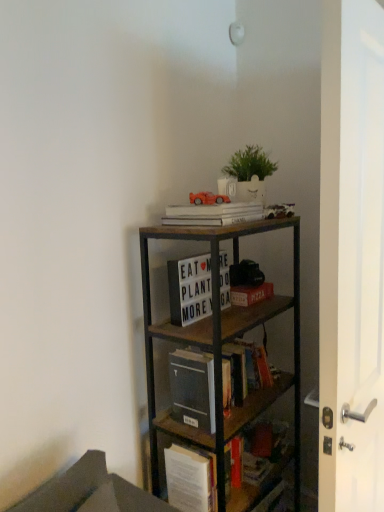
Question: In terms of width, does wooden book at center, placed as the first book when sorted from bottom to top, look wider or thinner when compared to white matte letter board at center, which is counted as the third book, starting from the bottom?

Choices:
 (A) wide
 (B) thin

Answer: (A)

Question: Is point (236, 367) positioned closer to the camera than point (187, 275)?

Choices:
 (A) closer
 (B) farther

Answer: (A)

Question: Estimate the real-world distances between objects in this image. Which object is closer to the white matte planter at upper center?

Choices:
 (A) wooden book at center, which ranks as the 4th book in top-to-bottom order
 (B) white matte book at upper center, which ranks as the first book in top-to-bottom order
 (C) white glossy door at right
 (D) white matte letter board at center, which is counted as the third book, starting from the bottom
 (E) matte cardboard book at center, the third book when ordered from top to bottom

Answer: (B)

Question: Which object is positioned closest to the matte cardboard book at center, which is the 2th book from bottom to top?

Choices:
 (A) white glossy door at right
 (B) wooden bookcase at upper right
 (C) white matte planter at upper center
 (D) white matte letter board at center, arranged as the 2th book when viewed from the top
 (E) white matte book at upper center, the fourth book positioned from the bottom

Answer: (D)